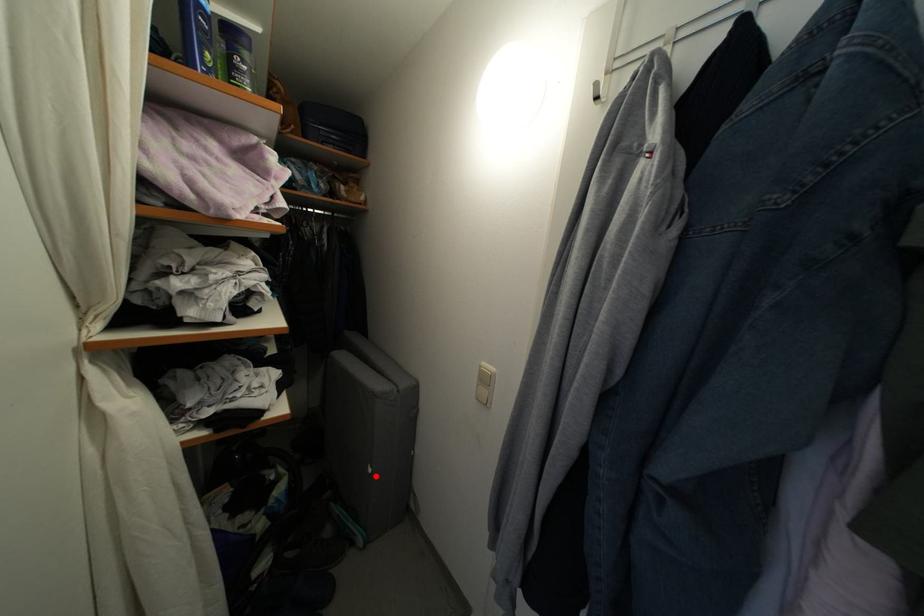
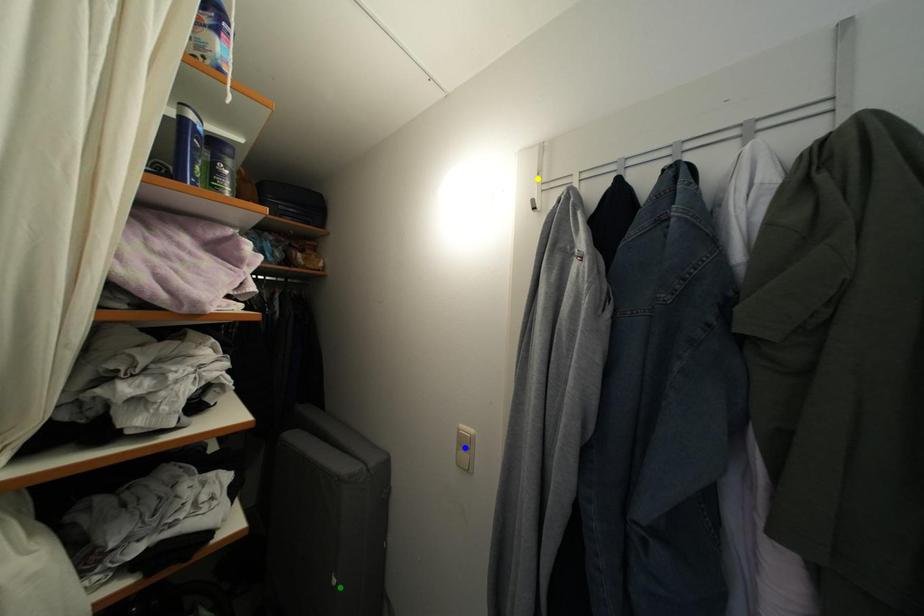
Question: I am providing you with two images of the same scene from different viewpoints. A red point is marked on the first image. You are given multiple points on the second image. In image 2, which mark is for the same physical point as the one in image 1?

Choices:
 (A) blue point
 (B) yellow point
 (C) green point

Answer: (C)